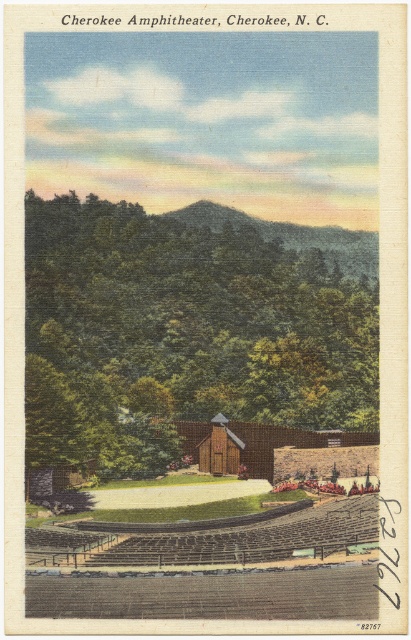
You are standing at the Cherokee Amphitheater and want to take a photo. There are two points of interest marked as point 1 at coordinates (196, 268) and point 2 at coordinates (219, 212). Which point should you focus on to capture a clearer image since it is closer to you?

Point 1 at coordinates (196, 268) is closer to the viewer than point 2 at coordinates (219, 212), so focusing on point 1 will result in a clearer image.